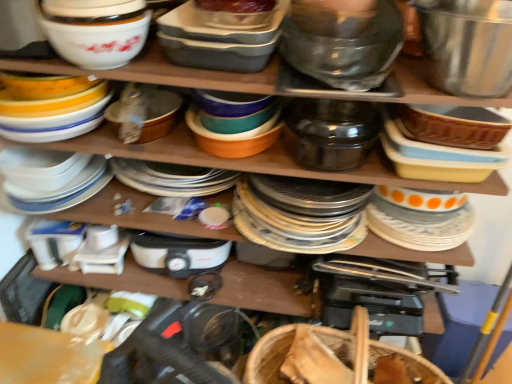
Question: Does white glossy bowl at upper left, the 2th appliance when ordered from right to left, contain white glossy bowl at upper left, the 1th bowl in the left-to-right sequence?

Choices:
 (A) no
 (B) yes

Answer: (A)

Question: From a real-world perspective, does white glossy bowl at upper left, the 2th appliance when ordered from right to left, stand above white glossy bowl at upper left, the 1th bowl in the left-to-right sequence?

Choices:
 (A) yes
 (B) no

Answer: (B)

Question: Can you confirm if white glossy bowl at upper left, positioned as the 1th appliance in left-to-right order, is wider than white glossy bowl at upper left, the 1th bowl in the left-to-right sequence?

Choices:
 (A) yes
 (B) no

Answer: (A)

Question: Is white glossy bowl at upper left, positioned as the 1th appliance in left-to-right order, smaller than white glossy bowl at upper left, marked as the 4th bowl in a right-to-left arrangement?

Choices:
 (A) yes
 (B) no

Answer: (B)

Question: Considering the relative positions of white glossy bowl at upper left, the 2th appliance when ordered from right to left, and white glossy bowl at upper left, the 1th bowl in the left-to-right sequence, in the image provided, is white glossy bowl at upper left, the 2th appliance when ordered from right to left, to the right of white glossy bowl at upper left, the 1th bowl in the left-to-right sequence, from the viewer's perspective?

Choices:
 (A) yes
 (B) no

Answer: (B)

Question: From the image's perspective, is shiny metallic bowl at upper right, arranged as the first bowl when viewed from the right, located above or below white glossy bowl at upper left, positioned as the 1th appliance in left-to-right order?

Choices:
 (A) below
 (B) above

Answer: (B)

Question: Which is correct: shiny metallic bowl at upper right, arranged as the first bowl when viewed from the right, is inside white glossy bowl at upper left, positioned as the 1th appliance in left-to-right order, or outside of it?

Choices:
 (A) outside
 (B) inside

Answer: (A)

Question: Is point (439, 41) closer or farther from the camera than point (44, 105)?

Choices:
 (A) farther
 (B) closer

Answer: (B)

Question: From a real-world perspective, is shiny metallic bowl at upper right, arranged as the first bowl when viewed from the right, physically located above or below white glossy bowl at upper left, the 2th appliance when ordered from right to left?

Choices:
 (A) below
 (B) above

Answer: (B)

Question: Considering the positions of satin black pot at center, which is counted as the 2th appliance, starting from the left, and bamboo weave basket at lower center in the image, is satin black pot at center, which is counted as the 2th appliance, starting from the left, bigger or smaller than bamboo weave basket at lower center?

Choices:
 (A) big
 (B) small

Answer: (B)

Question: From the image's perspective, is satin black pot at center, which is the 1th appliance in right-to-left order, located above or below bamboo weave basket at lower center?

Choices:
 (A) below
 (B) above

Answer: (B)

Question: Is satin black pot at center, which is the 1th appliance in right-to-left order, wider or thinner than bamboo weave basket at lower center?

Choices:
 (A) wide
 (B) thin

Answer: (A)

Question: Is point (362, 127) positioned closer to the camera than point (315, 382)?

Choices:
 (A) farther
 (B) closer

Answer: (A)

Question: Relative to white glossy bowl at upper left, positioned as the 1th appliance in left-to-right order, is translucent plastic container at upper center, which is the 3th bowl in right-to-left order, in front or behind?

Choices:
 (A) behind
 (B) front

Answer: (B)

Question: In terms of height, does translucent plastic container at upper center, which is the 3th bowl in right-to-left order, look taller or shorter compared to white glossy bowl at upper left, positioned as the 1th appliance in left-to-right order?

Choices:
 (A) tall
 (B) short

Answer: (B)